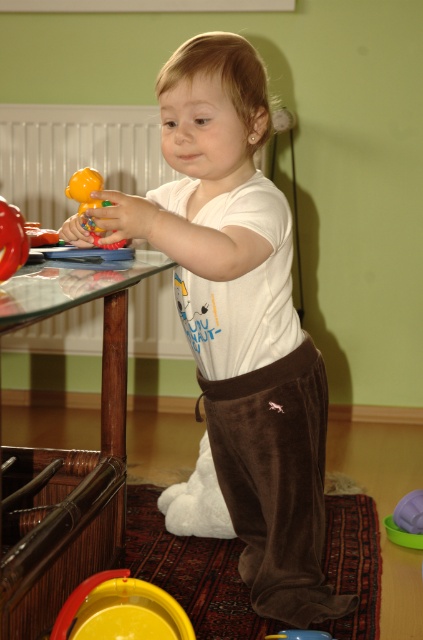
Does matte white radiator at left appear on the left side of rubber red ball at left?

Indeed, matte white radiator at left is positioned on the left side of rubber red ball at left.

Can you confirm if matte white radiator at left is shorter than rubber red ball at left?

In fact, matte white radiator at left may be taller than rubber red ball at left.

Is point (27, 116) farther from viewer compared to point (2, 224)?

Yes, it is behind point (2, 224).

What are the coordinates of `matte white radiator at left` in the screenshot? It's located at (76, 152).

Is transparent glass table at center smaller than smooth green ball at lower right?

No, transparent glass table at center is not smaller than smooth green ball at lower right.

Can you confirm if transparent glass table at center is thinner than smooth green ball at lower right?

No.

Is point (21, 474) farther from camera compared to point (387, 528)?

No.

Find the location of `transparent glass table at center`. transparent glass table at center is located at coordinates (66, 458).

Measure the distance between point (8, 224) and camera.

A distance of 3.30 feet exists between point (8, 224) and camera.

Does rubber red ball at left have a greater height compared to smooth green ball at lower right?

No, rubber red ball at left is not taller than smooth green ball at lower right.

Locate an element on the screen. The height and width of the screenshot is (640, 423). rubber red ball at left is located at coordinates (11, 240).